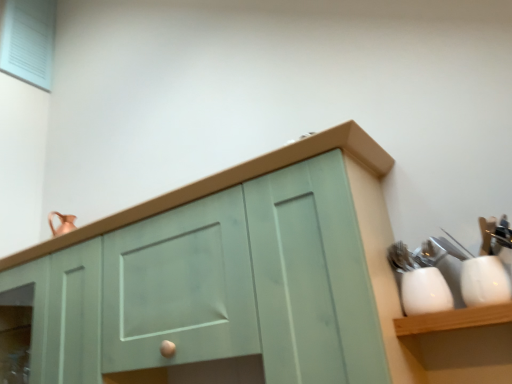
Question: Does white glossy cup at right, arranged as the first tableware when viewed from the left, come in front of matte green cabinet at center?

Choices:
 (A) no
 (B) yes

Answer: (A)

Question: Is white glossy cup at right, which appears as the second tableware when viewed from the right, looking in the opposite direction of matte green cabinet at center?

Choices:
 (A) yes
 (B) no

Answer: (B)

Question: Is matte green cabinet at center completely or partially inside white glossy cup at right, which appears as the second tableware when viewed from the right?

Choices:
 (A) no
 (B) yes

Answer: (A)

Question: Are white glossy cup at right, which appears as the second tableware when viewed from the right, and matte green cabinet at center far apart?

Choices:
 (A) no
 (B) yes

Answer: (A)

Question: Considering the relative sizes of white glossy cup at right, which appears as the second tableware when viewed from the right, and matte green cabinet at center in the image provided, is white glossy cup at right, which appears as the second tableware when viewed from the right, thinner than matte green cabinet at center?

Choices:
 (A) no
 (B) yes

Answer: (B)

Question: Is white glossy cup at right, which appears as the second tableware when viewed from the right, situated inside white glossy cup at right, which appears as the 1th tableware when viewed from the right, or outside?

Choices:
 (A) outside
 (B) inside

Answer: (A)

Question: In terms of size, does white glossy cup at right, arranged as the first tableware when viewed from the left, appear bigger or smaller than white glossy cup at right, which appears as the 1th tableware when viewed from the right?

Choices:
 (A) big
 (B) small

Answer: (B)

Question: Considering the positions of point (429, 309) and point (462, 261), is point (429, 309) closer or farther from the camera than point (462, 261)?

Choices:
 (A) farther
 (B) closer

Answer: (B)

Question: From the image's perspective, is white glossy cup at right, arranged as the first tableware when viewed from the left, above or below white glossy cup at right, which appears as the 1th tableware when viewed from the right?

Choices:
 (A) below
 (B) above

Answer: (A)

Question: Looking at their shapes, would you say matte green cabinet at center is wider or thinner than white glossy cup at right, arranged as the first tableware when viewed from the left?

Choices:
 (A) thin
 (B) wide

Answer: (B)

Question: Is matte green cabinet at center bigger or smaller than white glossy cup at right, which appears as the second tableware when viewed from the right?

Choices:
 (A) big
 (B) small

Answer: (A)

Question: Considering the positions of point 130,377 and point 412,284, is point 130,377 closer or farther from the camera than point 412,284?

Choices:
 (A) farther
 (B) closer

Answer: (A)

Question: Which is correct: matte green cabinet at center is inside white glossy cup at right, which appears as the second tableware when viewed from the right, or outside of it?

Choices:
 (A) inside
 (B) outside

Answer: (B)

Question: Is white glossy cup at right, which appears as the second tableware when viewed from the right, bigger or smaller than matte green cabinet at center?

Choices:
 (A) small
 (B) big

Answer: (A)

Question: Considering their positions, is white glossy cup at right, which appears as the second tableware when viewed from the right, located in front of or behind matte green cabinet at center?

Choices:
 (A) behind
 (B) front

Answer: (A)